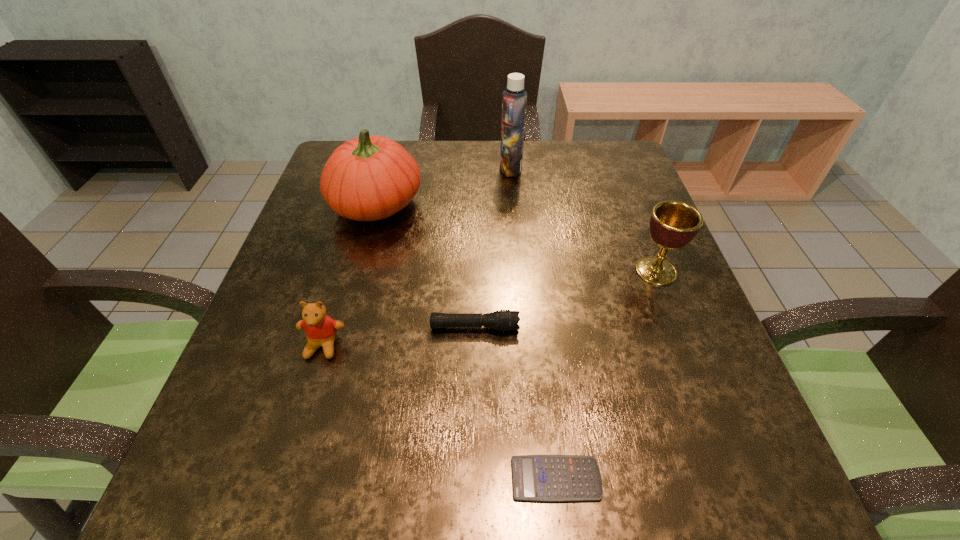
Where is `the tallest object`? the tallest object is located at coordinates (514, 100).

Locate an element on the screen. the fifth shortest object is located at coordinates (368, 178).

Where is `the fourth nearest object`? the fourth nearest object is located at coordinates (673, 224).

At what (x,y) coordinates should I click in order to perform the action: click on the rightmost object. Please return your answer as a coordinate pair (x, y). Looking at the image, I should click on (673, 224).

Find the location of a particular element. This screenshot has height=540, width=960. teddy bear is located at coordinates (320, 329).

Locate an element on the screen. This screenshot has height=540, width=960. the second shortest object is located at coordinates (504, 320).

I want to click on the shortest object, so click(544, 478).

At what (x,y) coordinates should I click in order to perform the action: click on calculator. Please return your answer as a coordinate pair (x, y). This screenshot has width=960, height=540. Looking at the image, I should click on [544, 478].

Find the location of a particular element. The height and width of the screenshot is (540, 960). blank space located on the front label of the tallest object is located at coordinates (413, 168).

I want to click on free space located 0.300m on the front label of the tallest object, so click(x=392, y=168).